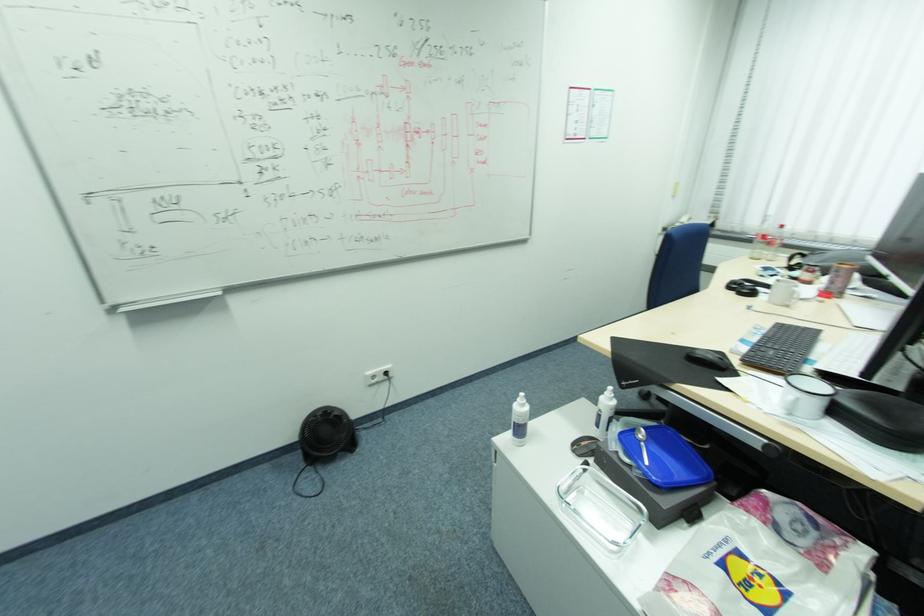
Which object does [708,359] point to?

It refers to a black computer mouse.